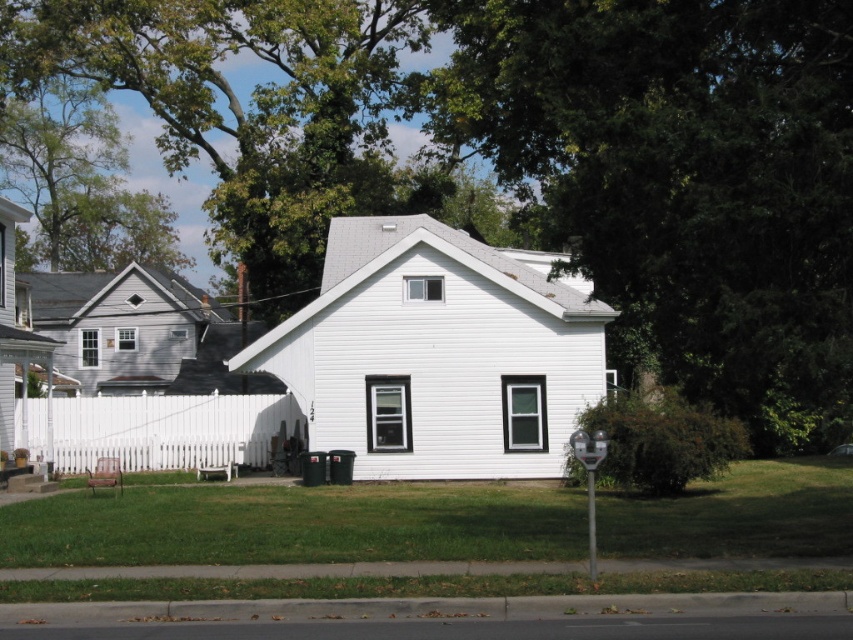
You are standing in front of the house and notice two points marked on the image. The first point is at coordinate point (815, 64) and the second is at point (616, 545). Which point is closer to you?

Point (815, 64) is closer to the camera than point (616, 545), so the first point is closer to you.

You are standing in front of the house and want to take a photo of the green leafy tree at upper center. If your camera can focus on objects up to 10 meters away, will you need to move closer or farther away to capture the tree clearly?

The green leafy tree at upper center is 11.31 meters away from the camera. Since the camera can focus up to 10 meters, you need to move closer to the tree to ensure it is within the camera range.